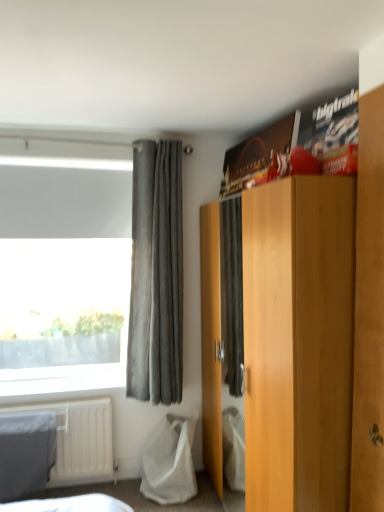
Question: Is light brown wood cabinet at center positioned with its back to white mesh bag at lower left?

Choices:
 (A) no
 (B) yes

Answer: (A)

Question: From the image's perspective, is light brown wood cabinet at center under white mesh bag at lower left?

Choices:
 (A) no
 (B) yes

Answer: (A)

Question: Is light brown wood cabinet at center directly adjacent to white mesh bag at lower left?

Choices:
 (A) yes
 (B) no

Answer: (B)

Question: Does light brown wood cabinet at center have a lesser height compared to white mesh bag at lower left?

Choices:
 (A) yes
 (B) no

Answer: (B)

Question: From a real-world perspective, is light brown wood cabinet at center on top of white mesh bag at lower left?

Choices:
 (A) yes
 (B) no

Answer: (A)

Question: Does point (165, 460) appear closer or farther from the camera than point (158, 377)?

Choices:
 (A) farther
 (B) closer

Answer: (A)

Question: From their relative heights in the image, would you say white mesh bag at lower left is taller or shorter than gray suede curtain at left?

Choices:
 (A) short
 (B) tall

Answer: (A)

Question: In the image, is white mesh bag at lower left positioned in front of or behind gray suede curtain at left?

Choices:
 (A) behind
 (B) front

Answer: (B)

Question: Choose the correct answer: Is white mesh bag at lower left inside gray suede curtain at left or outside it?

Choices:
 (A) inside
 (B) outside

Answer: (B)

Question: From the image's perspective, is gray cotton blanket at lower left located above or below light brown wood cabinet at center?

Choices:
 (A) below
 (B) above

Answer: (A)

Question: In the image, is gray cotton blanket at lower left positioned in front of or behind light brown wood cabinet at center?

Choices:
 (A) front
 (B) behind

Answer: (B)

Question: Looking at their shapes, would you say gray cotton blanket at lower left is wider or thinner than light brown wood cabinet at center?

Choices:
 (A) wide
 (B) thin

Answer: (B)

Question: From a real-world perspective, relative to light brown wood cabinet at center, is gray cotton blanket at lower left vertically above or below?

Choices:
 (A) above
 (B) below

Answer: (B)

Question: Is point (369, 389) closer or farther from the camera than point (175, 223)?

Choices:
 (A) farther
 (B) closer

Answer: (B)

Question: Which is correct: brown wooden wardrobe at upper right is inside gray suede curtain at left, or outside of it?

Choices:
 (A) outside
 (B) inside

Answer: (A)